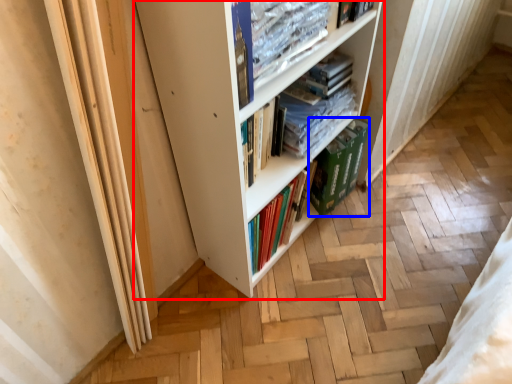
Question: Which object appears closest to the camera in this image, bookcase (highlighted by a red box) or paperback book (highlighted by a blue box)?

Choices:
 (A) bookcase
 (B) paperback book

Answer: (A)